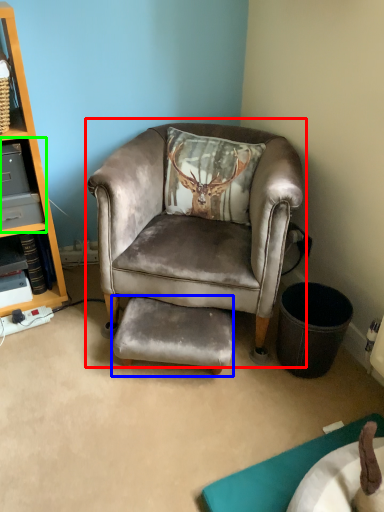
Question: Which object is positioned closest to chair (highlighted by a red box)? Select from footrest (highlighted by a blue box) and shelf (highlighted by a green box).

Choices:
 (A) footrest
 (B) shelf

Answer: (A)